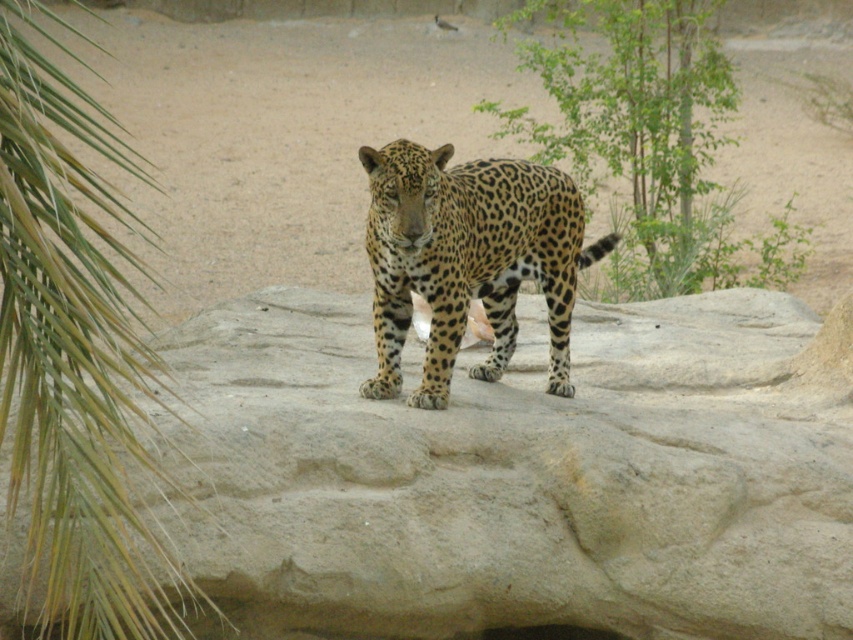
Can you confirm if smooth rock boulder at center is positioned below spotted fur leopard at center?

Yes, smooth rock boulder at center is below spotted fur leopard at center.

Can you confirm if smooth rock boulder at center is positioned above spotted fur leopard at center?

Actually, smooth rock boulder at center is below spotted fur leopard at center.

The image size is (853, 640). What are the coordinates of `smooth rock boulder at center` in the screenshot? It's located at (518, 476).

Image resolution: width=853 pixels, height=640 pixels. Find the location of `smooth rock boulder at center`. smooth rock boulder at center is located at coordinates (518, 476).

Does point (787, 602) lie in front of point (108, 269)?

No, (787, 602) is further to viewer.

Is smooth rock boulder at center thinner than green leafy palm at left?

Yes, smooth rock boulder at center is thinner than green leafy palm at left.

I want to click on smooth rock boulder at center, so click(x=518, y=476).

The image size is (853, 640). What do you see at coordinates (74, 356) in the screenshot?
I see `green leafy palm at left` at bounding box center [74, 356].

Is green leafy palm at left closer to the viewer compared to green leafy tree at upper right?

Yes, green leafy palm at left is closer to the viewer.

Measure the distance between green leafy palm at left and camera.

green leafy palm at left is 10.01 feet from camera.

Identify the location of green leafy palm at left. point(74,356).